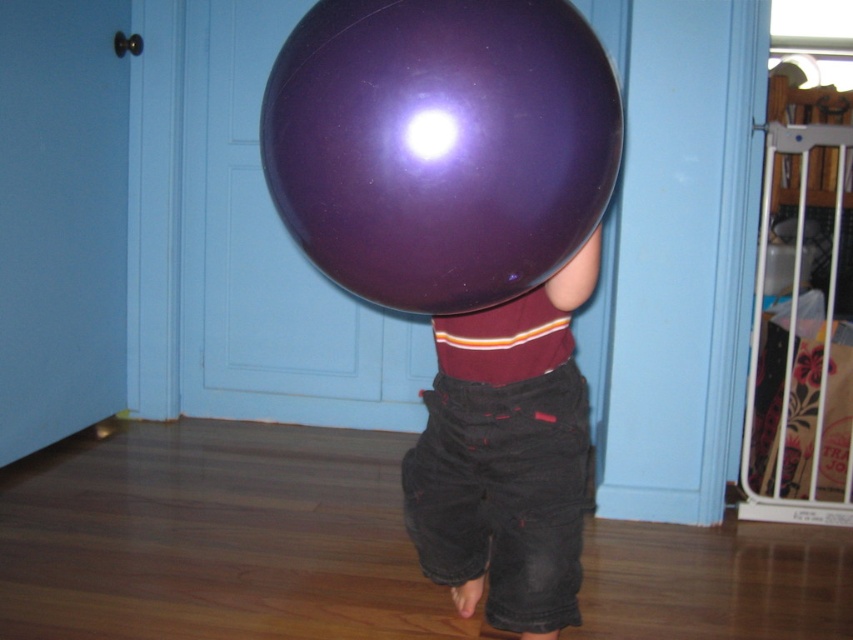
Question: In this image, where is shiny purple balloon at center located relative to denim shorts at center?

Choices:
 (A) right
 (B) left

Answer: (B)

Question: Which point appears farthest from the camera in this image?

Choices:
 (A) (x=535, y=625)
 (B) (x=416, y=17)

Answer: (A)

Question: Is shiny purple balloon at center below denim shorts at center?

Choices:
 (A) no
 (B) yes

Answer: (A)

Question: Which point is farther to the camera?

Choices:
 (A) (514, 403)
 (B) (409, 212)

Answer: (A)

Question: Which object appears farthest from the camera in this image?

Choices:
 (A) denim shorts at center
 (B) shiny purple balloon at center

Answer: (A)

Question: Does shiny purple balloon at center have a greater width compared to denim shorts at center?

Choices:
 (A) yes
 (B) no

Answer: (A)